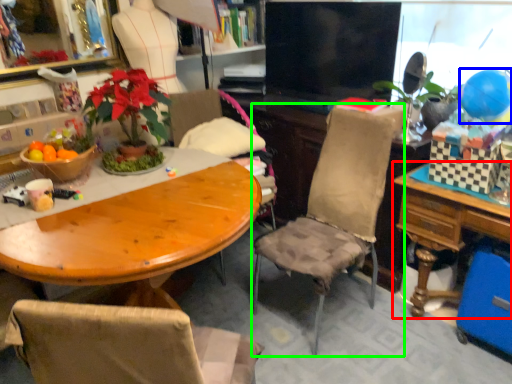
Question: Which object is positioned closest to table (highlighted by a red box)? Select from balloon (highlighted by a blue box) and chair (highlighted by a green box).

Choices:
 (A) balloon
 (B) chair

Answer: (B)